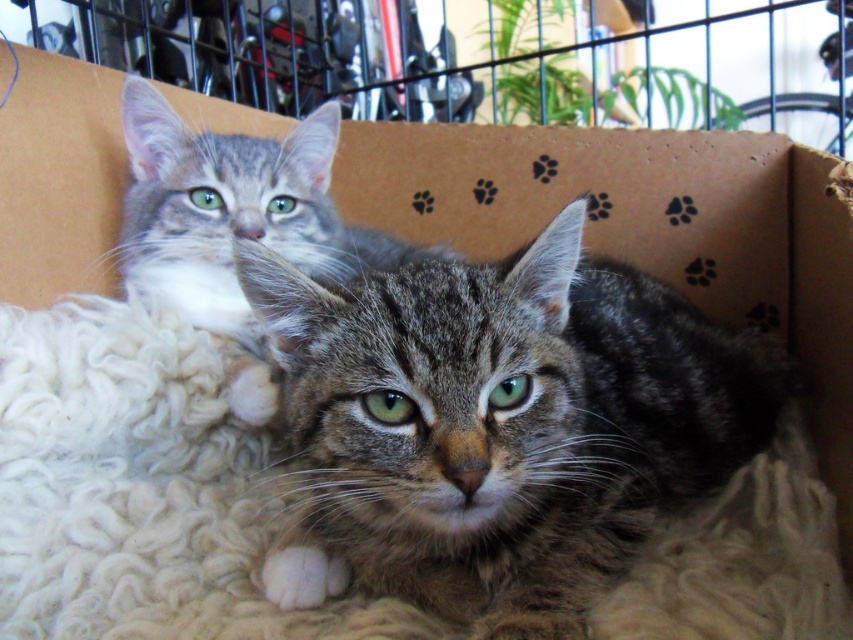
Does tabby fur cat at center have a greater width compared to tabby fur cat at upper left?

Indeed, tabby fur cat at center has a greater width compared to tabby fur cat at upper left.

Who is positioned more to the right, tabby fur cat at center or tabby fur cat at upper left?

From the viewer's perspective, tabby fur cat at center appears more on the right side.

Does point (753, 449) lie behind point (248, 340)?

That is False.

Where is `tabby fur cat at center`? tabby fur cat at center is located at coordinates (500, 426).